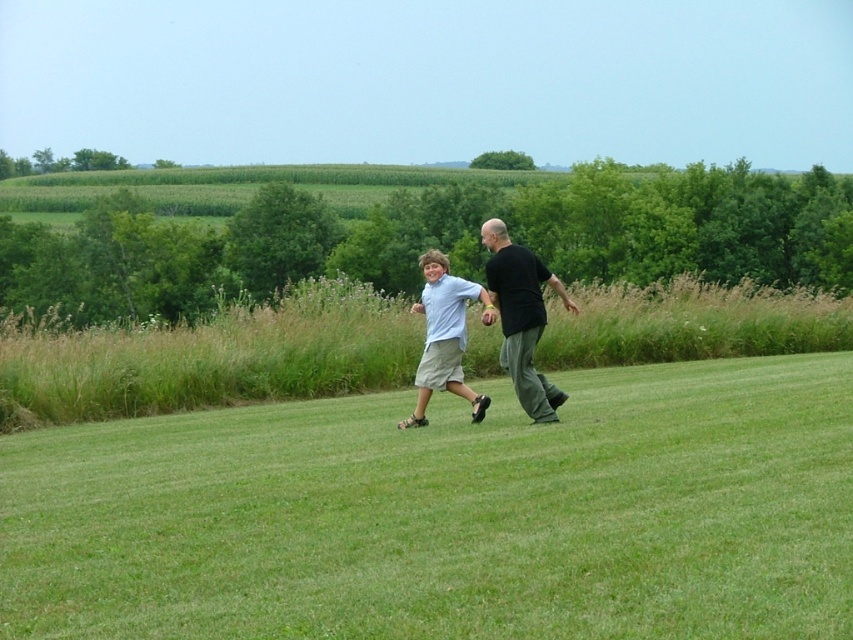
Question: Can you confirm if black matte shirt at center is wider than light blue cotton shirt at center?

Choices:
 (A) no
 (B) yes

Answer: (A)

Question: Is black matte shirt at center bigger than light blue cotton shirt at center?

Choices:
 (A) yes
 (B) no

Answer: (B)

Question: Is green grassy field at center bigger than black matte shirt at center?

Choices:
 (A) no
 (B) yes

Answer: (B)

Question: Which point is farther to the camera?

Choices:
 (A) black matte shirt at center
 (B) light blue cotton shirt at center

Answer: (B)

Question: Considering the real-world distances, which object is farthest from the light blue cotton shirt at center?

Choices:
 (A) black matte shirt at center
 (B) green grassy field at center

Answer: (B)

Question: Which object is farther from the camera taking this photo?

Choices:
 (A) black matte shirt at center
 (B) light blue cotton shirt at center
 (C) green grassy field at center

Answer: (B)